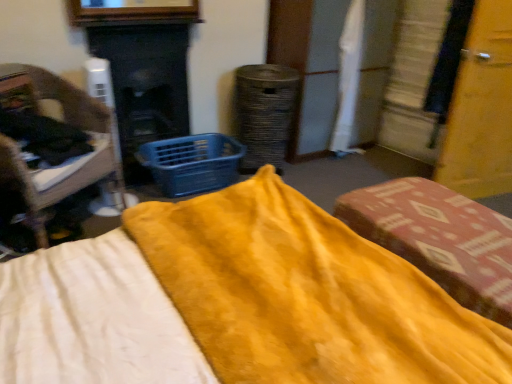
The height and width of the screenshot is (384, 512). Describe the element at coordinates (145, 84) in the screenshot. I see `smooth black fireplace at center-left` at that location.

What do you see at coordinates (237, 302) in the screenshot?
I see `yellow soft fabric bed at center` at bounding box center [237, 302].

This screenshot has height=384, width=512. In order to click on smooth black fireplace at center-left in this screenshot , I will do `click(145, 84)`.

Would you say velvet yellow cushion at center, marked as the first furniture in a right-to-left arrangement, is inside or outside wooden chair at left, placed as the 1th furniture when sorted from left to right?

velvet yellow cushion at center, marked as the first furniture in a right-to-left arrangement, exists outside the volume of wooden chair at left, placed as the 1th furniture when sorted from left to right.

Based on their sizes in the image, would you say velvet yellow cushion at center, which is the 2th furniture from left to right, is bigger or smaller than wooden chair at left, placed as the 1th furniture when sorted from left to right?

Considering their sizes, velvet yellow cushion at center, which is the 2th furniture from left to right, takes up less space than wooden chair at left, placed as the 1th furniture when sorted from left to right.

Is velvet yellow cushion at center, which is the 2th furniture from left to right, not close to wooden chair at left, the second furniture viewed from the right?

velvet yellow cushion at center, which is the 2th furniture from left to right, is positioned a significant distance from wooden chair at left, the second furniture viewed from the right.

Looking at their sizes, would you say velvet yellow cushion at center, marked as the first furniture in a right-to-left arrangement, is wider or thinner than wooden chair at left, placed as the 1th furniture when sorted from left to right?

velvet yellow cushion at center, marked as the first furniture in a right-to-left arrangement, is thinner than wooden chair at left, placed as the 1th furniture when sorted from left to right.

Is blue plastic basket at center to the left of wooden chair at left, placed as the 1th furniture when sorted from left to right, from the viewer's perspective?

No.

Which is closer, (160, 144) or (116, 163)?

Clearly, point (160, 144) is more distant from the camera than point (116, 163).

Is blue plastic basket at center facing away from wooden chair at left, placed as the 1th furniture when sorted from left to right?

No, wooden chair at left, placed as the 1th furniture when sorted from left to right, is not at the back of blue plastic basket at center.

Considering the sizes of yellow soft fabric bed at center and blue plastic basket at center in the image, is yellow soft fabric bed at center taller or shorter than blue plastic basket at center?

In the image, yellow soft fabric bed at center appears to be shorter than blue plastic basket at center.

Which is in front, yellow soft fabric bed at center or blue plastic basket at center?

yellow soft fabric bed at center is closer to the camera.

At what (x,y) coordinates should I click in order to perform the action: click on bed below the blue plastic basket at center (from the image's perspective). Please return your answer as a coordinate pair (x, y). Looking at the image, I should click on (237, 302).

From the image's perspective, which object appears higher, yellow soft fabric bed at center or blue plastic basket at center?

blue plastic basket at center appears higher in the image.

Which is closer to the camera, (164, 59) or (35, 361)?

Point (164, 59) is positioned farther from the camera compared to point (35, 361).

Is smooth black fireplace at center-left taller or shorter than yellow soft fabric bed at center?

Considering their sizes, smooth black fireplace at center-left has more height than yellow soft fabric bed at center.

Does smooth black fireplace at center-left lie in front of yellow soft fabric bed at center?

No, the depth of smooth black fireplace at center-left is greater than that of yellow soft fabric bed at center.

How many degrees apart are the facing directions of smooth black fireplace at center-left and yellow soft fabric bed at center?

There is a 88.5-degree angle between the facing directions of smooth black fireplace at center-left and yellow soft fabric bed at center.

Who is taller, wooden chair at left, the second furniture viewed from the right, or blue plastic basket at center?

Standing taller between the two is wooden chair at left, the second furniture viewed from the right.

Which is closer to the camera, (x=26, y=78) or (x=215, y=158)?

Positioned in front is point (x=26, y=78).

Is the surface of wooden chair at left, placed as the 1th furniture when sorted from left to right, in direct contact with blue plastic basket at center?

They are not placed beside each other.

Which of these two, wooden chair at left, the second furniture viewed from the right, or blue plastic basket at center, is smaller?

Smaller between the two is blue plastic basket at center.

How many degrees apart are the facing directions of wooden chair at left, the second furniture viewed from the right, and smooth black fireplace at center-left?

28.2 degrees.

Can you confirm if wooden chair at left, the second furniture viewed from the right, is smaller than smooth black fireplace at center-left?

Incorrect, wooden chair at left, the second furniture viewed from the right, is not smaller in size than smooth black fireplace at center-left.

From the image's perspective, would you say wooden chair at left, the second furniture viewed from the right, is shown under smooth black fireplace at center-left?

Yes, from the image's perspective, wooden chair at left, the second furniture viewed from the right, is beneath smooth black fireplace at center-left.

In terms of size, does yellow soft fabric bed at center appear bigger or smaller than wooden chair at left, placed as the 1th furniture when sorted from left to right?

Clearly, yellow soft fabric bed at center is smaller in size than wooden chair at left, placed as the 1th furniture when sorted from left to right.

Between point (224, 233) and point (114, 185), which one is positioned in front?

Point (224, 233)

Are yellow soft fabric bed at center and wooden chair at left, placed as the 1th furniture when sorted from left to right, making contact?

There is a gap between yellow soft fabric bed at center and wooden chair at left, placed as the 1th furniture when sorted from left to right.

Is yellow soft fabric bed at center facing away from wooden chair at left, the second furniture viewed from the right?

That's not correct — yellow soft fabric bed at center is not looking away from wooden chair at left, the second furniture viewed from the right.

I want to click on furniture behind the velvet yellow cushion at center, marked as the first furniture in a right-to-left arrangement, so click(x=68, y=164).

The width and height of the screenshot is (512, 384). Find the location of `basket on the right of wooden chair at left, the second furniture viewed from the right`. basket on the right of wooden chair at left, the second furniture viewed from the right is located at coordinates (192, 163).

When comparing their distances from wooden chair at left, the second furniture viewed from the right, does velvet yellow cushion at center, marked as the first furniture in a right-to-left arrangement, or yellow soft fabric bed at center seem closer?

yellow soft fabric bed at center is positioned closer to the anchor wooden chair at left, the second furniture viewed from the right.

Looking at the image, which one is located closer to yellow soft fabric bed at center, smooth black fireplace at center-left or blue plastic basket at center?

blue plastic basket at center.

Which object lies further to the anchor point smooth black fireplace at center-left, wooden chair at left, placed as the 1th furniture when sorted from left to right, or velvet yellow cushion at center, marked as the first furniture in a right-to-left arrangement?

Among the two, velvet yellow cushion at center, marked as the first furniture in a right-to-left arrangement, is located further to smooth black fireplace at center-left.

When comparing their distances from smooth black fireplace at center-left, does velvet yellow cushion at center, marked as the first furniture in a right-to-left arrangement, or blue plastic basket at center seem further?

velvet yellow cushion at center, marked as the first furniture in a right-to-left arrangement, is further to smooth black fireplace at center-left.

Estimate the real-world distances between objects in this image. Which object is further from velvet yellow cushion at center, marked as the first furniture in a right-to-left arrangement, blue plastic basket at center or wooden chair at left, the second furniture viewed from the right?

wooden chair at left, the second furniture viewed from the right, is further to velvet yellow cushion at center, marked as the first furniture in a right-to-left arrangement.

Based on their spatial positions, is yellow soft fabric bed at center or smooth black fireplace at center-left further from wooden chair at left, placed as the 1th furniture when sorted from left to right?

yellow soft fabric bed at center is further to wooden chair at left, placed as the 1th furniture when sorted from left to right.

Estimate the real-world distances between objects in this image. Which object is closer to smooth black fireplace at center-left, yellow soft fabric bed at center or blue plastic basket at center?

Among the two, blue plastic basket at center is located nearer to smooth black fireplace at center-left.

Based on their spatial positions, is blue plastic basket at center or yellow soft fabric bed at center further from velvet yellow cushion at center, which is the 2th furniture from left to right?

blue plastic basket at center.

Find the location of a particular element. The image size is (512, 384). basket located between wooden chair at left, placed as the 1th furniture when sorted from left to right, and velvet yellow cushion at center, marked as the first furniture in a right-to-left arrangement, in the left-right direction is located at coordinates (192, 163).

The height and width of the screenshot is (384, 512). Find the location of `fireplace between wooden chair at left, the second furniture viewed from the right, and blue plastic basket at center, along the z-axis`. fireplace between wooden chair at left, the second furniture viewed from the right, and blue plastic basket at center, along the z-axis is located at coordinates (145, 84).

Identify the location of fireplace between velvet yellow cushion at center, which is the 2th furniture from left to right, and blue plastic basket at center from front to back. Image resolution: width=512 pixels, height=384 pixels. (145, 84).

Find the location of a particular element. bed located between wooden chair at left, placed as the 1th furniture when sorted from left to right, and velvet yellow cushion at center, marked as the first furniture in a right-to-left arrangement, in the left-right direction is located at coordinates (237, 302).